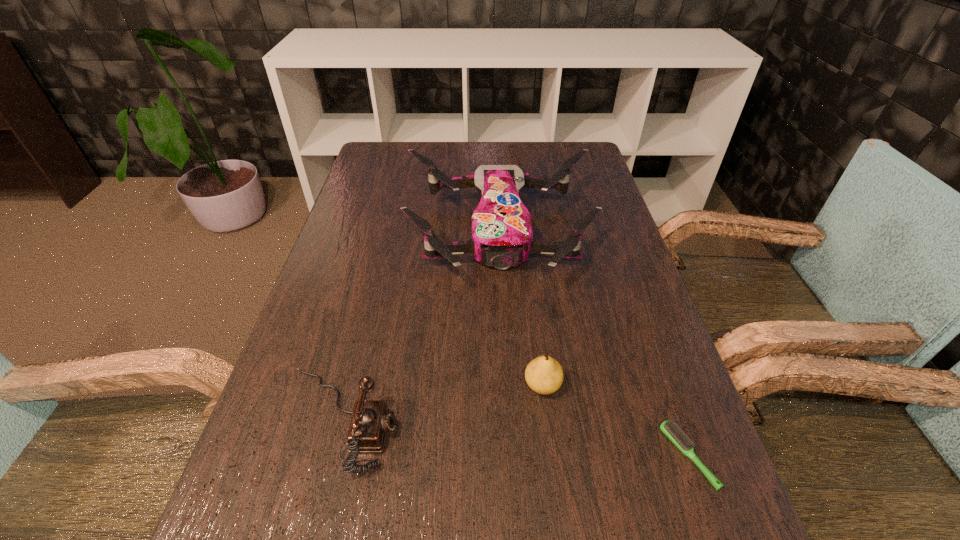
At what (x,y) coordinates should I click in order to perform the action: click on free space that satisfies the following two spatial constraints: 1. on the front-facing side of the hairbrush; 2. on the left side of the tallest object. Please return your answer as a coordinate pair (x, y). Looking at the image, I should click on (512, 456).

Locate an element on the screen. The image size is (960, 540). vacant region that satisfies the following two spatial constraints: 1. on the front-facing side of the drone; 2. on the left side of the pear is located at coordinates [x=508, y=385].

This screenshot has width=960, height=540. I want to click on free location that satisfies the following two spatial constraints: 1. on the front-facing side of the shortest object; 2. on the right side of the drone, so click(x=512, y=456).

I want to click on vacant point that satisfies the following two spatial constraints: 1. on the front-facing side of the pear; 2. on the right side of the tallest object, so click(508, 385).

You are a GUI agent. You are given a task and a screenshot of the screen. Output one action in this format:
    pyautogui.click(x=<x>, y=<y>)
    Task: Click on the free space in the image that satisfies the following two spatial constraints: 1. on the front-facing side of the pear; 2. on the right side of the farthest object
    
    Given the screenshot: What is the action you would take?
    pyautogui.click(x=508, y=385)

Find the location of a particular element. free space that satisfies the following two spatial constraints: 1. on the back side of the shortest object; 2. on the dial of the telephone is located at coordinates (676, 420).